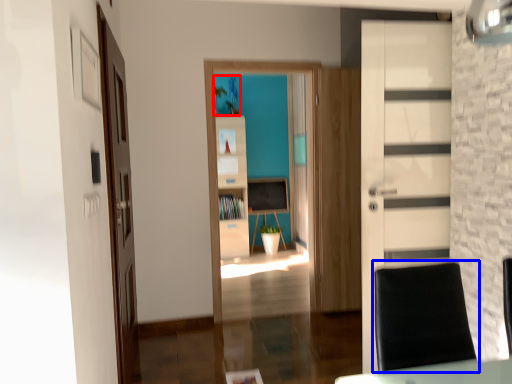
Question: Which object appears closest to the camera in this image, plant (highlighted by a red box) or swivel chair (highlighted by a blue box)?

Choices:
 (A) plant
 (B) swivel chair

Answer: (B)